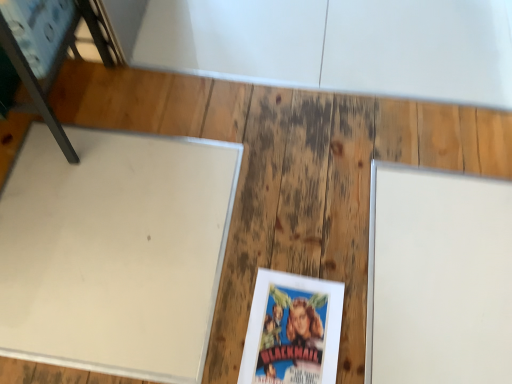
This screenshot has width=512, height=384. Identify the location of free spot to the right of white matte board at left. pyautogui.click(x=301, y=222).